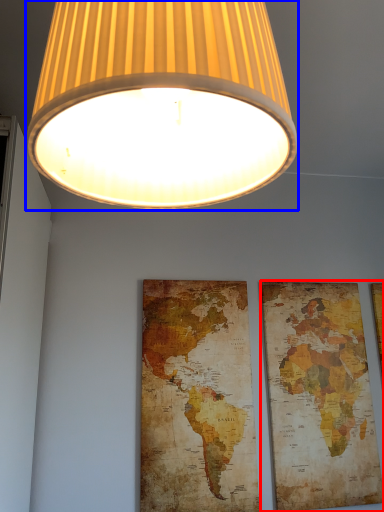
Question: Which point is closer to the camera, picture frame (highlighted by a red box) or lamp (highlighted by a blue box)?

Choices:
 (A) picture frame
 (B) lamp

Answer: (B)